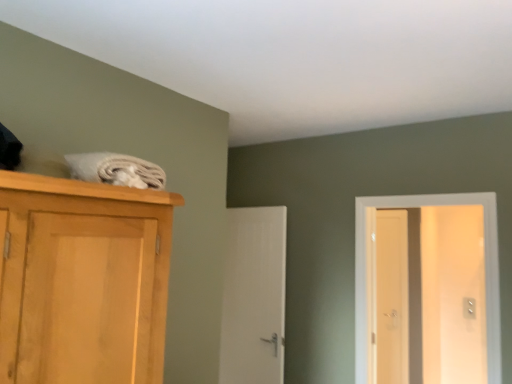
Question: Considering the relative sizes of white glossy door at right, which ranks as the 1th door in right-to-left order, and white smooth door at center, which is the 1th door in back-to-front order, in the image provided, is white glossy door at right, which ranks as the 1th door in right-to-left order, smaller than white smooth door at center, which is the 1th door in back-to-front order,?

Choices:
 (A) no
 (B) yes

Answer: (A)

Question: Does white glossy door at right, the 2th door in the back-to-front sequence, lie in front of white smooth door at center, which is the 1th door in back-to-front order?

Choices:
 (A) no
 (B) yes

Answer: (B)

Question: Does white glossy door at right, which ranks as the 2th door in left-to-right order, have a lesser width compared to white smooth door at center, which is counted as the second door, starting from the front?

Choices:
 (A) no
 (B) yes

Answer: (A)

Question: Can you confirm if white glossy door at right, the first door from the front, is bigger than white smooth door at center, which is counted as the second door, starting from the front?

Choices:
 (A) yes
 (B) no

Answer: (A)

Question: Could you tell me if white glossy door at right, the first door from the front, is turned towards white smooth door at center, which is counted as the first door, starting from the left?

Choices:
 (A) no
 (B) yes

Answer: (A)

Question: From the image's perspective, does white glossy door at right, the first door from the front, appear lower than white smooth door at center, marked as the second door in a right-to-left arrangement?

Choices:
 (A) yes
 (B) no

Answer: (B)

Question: Does white smooth door at center, which is counted as the second door, starting from the front, appear on the right side of light brown wooden screen door at right?

Choices:
 (A) yes
 (B) no

Answer: (B)

Question: Does white smooth door at center, which is counted as the first door, starting from the left, have a larger size compared to light brown wooden screen door at right?

Choices:
 (A) yes
 (B) no

Answer: (A)

Question: Is white smooth door at center, which is counted as the first door, starting from the left, closer to the viewer compared to light brown wooden screen door at right?

Choices:
 (A) no
 (B) yes

Answer: (B)

Question: Does white smooth door at center, marked as the second door in a right-to-left arrangement, appear on the left side of light brown wooden screen door at right?

Choices:
 (A) no
 (B) yes

Answer: (B)

Question: Is white smooth door at center, marked as the second door in a right-to-left arrangement, oriented away from light brown wooden screen door at right?

Choices:
 (A) no
 (B) yes

Answer: (B)

Question: Are white smooth door at center, marked as the second door in a right-to-left arrangement, and light brown wooden screen door at right far apart?

Choices:
 (A) yes
 (B) no

Answer: (A)

Question: Could you tell me if light brown wooden screen door at right is turned towards white glossy door at right, the first door from the front?

Choices:
 (A) no
 (B) yes

Answer: (A)